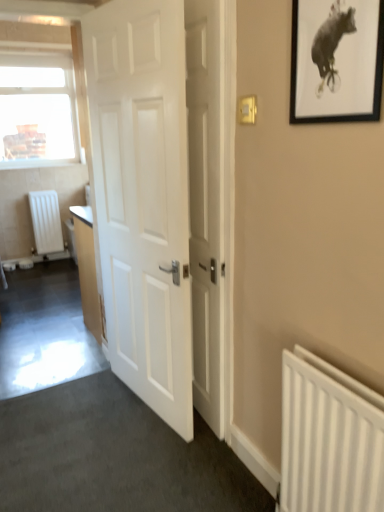
What do you see at coordinates (329, 438) in the screenshot?
I see `white matte radiator at lower right, which is the 2th radiator from top to bottom` at bounding box center [329, 438].

This screenshot has width=384, height=512. What do you see at coordinates (206, 203) in the screenshot? I see `white wooden door at center, the 2th door from the left` at bounding box center [206, 203].

Where is `clear glass window at upper left`? The height and width of the screenshot is (512, 384). clear glass window at upper left is located at coordinates (37, 110).

Is black matte picture frame at upper right completely or partially outside of white matte door at center, arranged as the 1th door when viewed from the left?

black matte picture frame at upper right is positioned outside white matte door at center, arranged as the 1th door when viewed from the left.

From the image's perspective, is black matte picture frame at upper right positioned above or below white matte door at center, arranged as the 1th door when viewed from the left?

black matte picture frame at upper right is situated higher than white matte door at center, arranged as the 1th door when viewed from the left, in the image.

From a real-world perspective, which is physically above, black matte picture frame at upper right or white matte door at center, the 2th door positioned from the right?

black matte picture frame at upper right, from a real-world perspective.

Is white plastic light switch at upper right further to camera compared to white wooden door at center, which is the 1th door in right-to-left order?

No, white plastic light switch at upper right is closer to the viewer.

From the image's perspective, would you say white plastic light switch at upper right is positioned over white wooden door at center, which is the 1th door in right-to-left order?

Correct, white plastic light switch at upper right appears higher than white wooden door at center, which is the 1th door in right-to-left order, in the image.

The image size is (384, 512). I want to click on light switch that is on the right side of white wooden door at center, the 2th door from the left, so click(247, 109).

Is white plastic light switch at upper right far from white wooden door at center, which is the 1th door in right-to-left order?

No, white plastic light switch at upper right is not far away from white wooden door at center, which is the 1th door in right-to-left order.

Considering the positions of points (38, 159) and (201, 382), is point (38, 159) farther from camera compared to point (201, 382)?

That is True.

From a real-world perspective, between clear glass window at upper left and white wooden door at center, the 2th door from the left, who is vertically higher?

clear glass window at upper left, from a real-world perspective.

In terms of width, does clear glass window at upper left look wider or thinner when compared to white wooden door at center, the 2th door from the left?

In the image, clear glass window at upper left appears to be more narrow than white wooden door at center, the 2th door from the left.

Which of these two, white wooden door at center, which is the 1th door in right-to-left order, or black matte picture frame at upper right, stands taller?

With more height is white wooden door at center, which is the 1th door in right-to-left order.

From a real-world perspective, between white wooden door at center, the 2th door from the left, and black matte picture frame at upper right, who is vertically lower?

white wooden door at center, the 2th door from the left.

Considering the points (199, 232) and (298, 74), which point is in front, point (199, 232) or point (298, 74)?

The point (298, 74) is closer to the camera.

Is white wooden door at center, which is the 1th door in right-to-left order, directly adjacent to black matte picture frame at upper right?

No, white wooden door at center, which is the 1th door in right-to-left order, is not with black matte picture frame at upper right.

Which is correct: white matte door at center, arranged as the 1th door when viewed from the left, is inside white matte radiator at lower right, which is the 2th radiator in left-to-right order, or outside of it?

white matte door at center, arranged as the 1th door when viewed from the left, lies outside white matte radiator at lower right, which is the 2th radiator in left-to-right order.

Based on the photo, is white matte door at center, arranged as the 1th door when viewed from the left, to the left of white matte radiator at lower right, arranged as the first radiator when ordered from the bottom, from the viewer's perspective?

Correct, you'll find white matte door at center, arranged as the 1th door when viewed from the left, to the left of white matte radiator at lower right, arranged as the first radiator when ordered from the bottom.

Does white matte door at center, arranged as the 1th door when viewed from the left, lie in front of white matte radiator at lower right, marked as the 2th radiator in a back-to-front arrangement?

No, white matte door at center, arranged as the 1th door when viewed from the left, is further to the viewer.

Considering the positions of point (239, 112) and point (23, 74), is point (239, 112) closer or farther from the camera than point (23, 74)?

Clearly, point (239, 112) is closer to the camera than point (23, 74).

Consider the image. Is white plastic light switch at upper right located outside clear glass window at upper left?

That's correct, white plastic light switch at upper right is outside of clear glass window at upper left.

Are white plastic light switch at upper right and clear glass window at upper left making contact?

No.

At what (x,y) coordinates should I click in order to perform the action: click on light switch on the right of clear glass window at upper left. Please return your answer as a coordinate pair (x, y). Image resolution: width=384 pixels, height=512 pixels. Looking at the image, I should click on (247, 109).

Identify the location of window in front of the white matte radiator at left, the 1th radiator from the top. This screenshot has width=384, height=512. (37, 110).

Is white matte radiator at left, which is the 2th radiator from bottom to top, touching clear glass window at upper left?

No, white matte radiator at left, which is the 2th radiator from bottom to top, is not touching clear glass window at upper left.

Can you confirm if white matte radiator at left, the 1th radiator in the back-to-front sequence, is bigger than clear glass window at upper left?

No, white matte radiator at left, the 1th radiator in the back-to-front sequence, is not bigger than clear glass window at upper left.

The width and height of the screenshot is (384, 512). I want to click on the 2nd door counting from the left side of the black matte picture frame at upper right, so click(143, 197).

Image resolution: width=384 pixels, height=512 pixels. Find the location of `light switch located above the white wooden door at center, which is the 1th door in right-to-left order (from a real-world perspective)`. light switch located above the white wooden door at center, which is the 1th door in right-to-left order (from a real-world perspective) is located at coordinates (247, 109).

Which object lies nearer to the anchor point white matte radiator at lower right, which appears as the 1th radiator when viewed from the front, white matte door at center, the 2th door positioned from the right, or white plastic light switch at upper right?

white matte door at center, the 2th door positioned from the right.

Looking at the image, which one is located closer to white plastic light switch at upper right, black matte picture frame at upper right or white matte door at center, the 2th door positioned from the right?

black matte picture frame at upper right is closer to white plastic light switch at upper right.

Looking at the image, which one is located further to white matte radiator at lower right, which is the 2th radiator from top to bottom, black matte picture frame at upper right or white matte door at center, arranged as the 1th door when viewed from the left?

white matte door at center, arranged as the 1th door when viewed from the left, is further to white matte radiator at lower right, which is the 2th radiator from top to bottom.

Based on their spatial positions, is white wooden door at center, which is the 1th door in right-to-left order, or black matte picture frame at upper right further from white matte radiator at left, the 1th radiator in the back-to-front sequence?

black matte picture frame at upper right lies further to white matte radiator at left, the 1th radiator in the back-to-front sequence, than the other object.

Estimate the real-world distances between objects in this image. Which object is further from white matte radiator at lower right, arranged as the first radiator when ordered from the bottom, white wooden door at center, which is the 1th door in right-to-left order, or black matte picture frame at upper right?

The object further to white matte radiator at lower right, arranged as the first radiator when ordered from the bottom, is black matte picture frame at upper right.

From the image, which object appears to be nearer to clear glass window at upper left, black matte picture frame at upper right or white matte radiator at left, the 1th radiator from the top?

white matte radiator at left, the 1th radiator from the top, lies closer to clear glass window at upper left than the other object.

Considering their positions, is white matte radiator at left, the first radiator in the left-to-right sequence, positioned closer to clear glass window at upper left than white matte radiator at lower right, arranged as the first radiator when ordered from the bottom?

white matte radiator at left, the first radiator in the left-to-right sequence, is positioned closer to the anchor clear glass window at upper left.

Looking at the image, which one is located closer to black matte picture frame at upper right, white wooden door at center, the 2th door from the left, or white matte door at center, arranged as the 1th door when viewed from the left?

Among the two, white wooden door at center, the 2th door from the left, is located nearer to black matte picture frame at upper right.

Locate an element on the screen. light switch between black matte picture frame at upper right and clear glass window at upper left along the z-axis is located at coordinates (247, 109).

This screenshot has height=512, width=384. What are the coordinates of `window between white matte radiator at lower right, the first radiator viewed from the right, and white matte radiator at left, the 1th radiator from the top, along the z-axis` in the screenshot? It's located at (37, 110).

Where is `light switch located between black matte picture frame at upper right and white matte radiator at left, the first radiator in the left-to-right sequence, in the depth direction`? The height and width of the screenshot is (512, 384). light switch located between black matte picture frame at upper right and white matte radiator at left, the first radiator in the left-to-right sequence, in the depth direction is located at coordinates (247, 109).

Find the location of a particular element. window between white wooden door at center, which is the 1th door in right-to-left order, and white matte radiator at left, which is counted as the 2th radiator, starting from the right, from front to back is located at coordinates (37, 110).